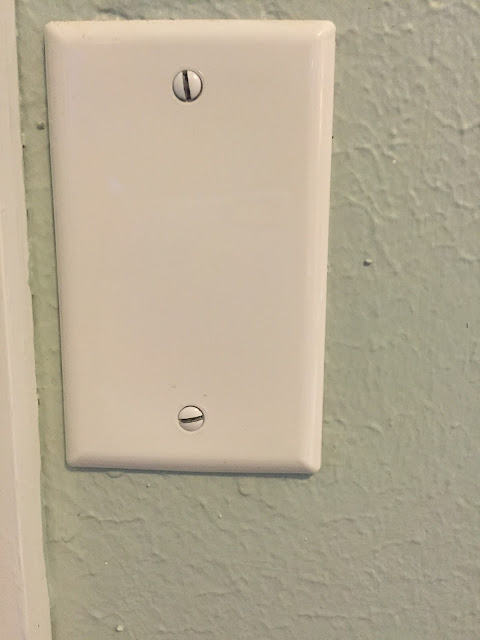
Locate an element on the screen. Image resolution: width=480 pixels, height=640 pixels. corners is located at coordinates (309, 468), (68, 464), (325, 29), (56, 28).